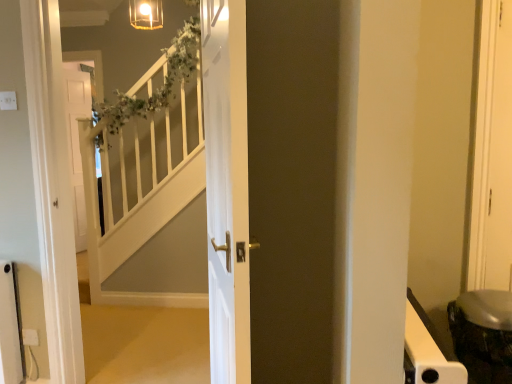
Question: Would you say white glossy door at center is part of white plastic electric outlet at lower left's contents?

Choices:
 (A) yes
 (B) no

Answer: (B)

Question: Is white plastic electric outlet at lower left completely or partially outside of white glossy door at center?

Choices:
 (A) no
 (B) yes

Answer: (B)

Question: From a real-world perspective, does white plastic electric outlet at lower left sit lower than white glossy door at center?

Choices:
 (A) yes
 (B) no

Answer: (A)

Question: Does white plastic electric outlet at lower left have a smaller size compared to white glossy door at center?

Choices:
 (A) yes
 (B) no

Answer: (A)

Question: Can you confirm if white plastic electric outlet at lower left is bigger than white glossy door at center?

Choices:
 (A) no
 (B) yes

Answer: (A)

Question: Is white plastic electric outlet at lower left behind white glossy door at center?

Choices:
 (A) no
 (B) yes

Answer: (B)

Question: From a real-world perspective, is white glossy door at center beneath white plastic electric outlet at lower left?

Choices:
 (A) no
 (B) yes

Answer: (A)

Question: Can you confirm if white glossy door at center is wider than white plastic electric outlet at lower left?

Choices:
 (A) yes
 (B) no

Answer: (A)

Question: Is white glossy door at center positioned in front of white plastic electric outlet at lower left?

Choices:
 (A) yes
 (B) no

Answer: (A)

Question: Is white glossy door at center oriented away from white plastic electric outlet at lower left?

Choices:
 (A) yes
 (B) no

Answer: (B)

Question: Is white glossy door at center smaller than white plastic electric outlet at lower left?

Choices:
 (A) yes
 (B) no

Answer: (B)

Question: Would you say white glossy door at center contains white plastic electric outlet at lower left?

Choices:
 (A) yes
 (B) no

Answer: (B)

Question: Is white glossy door at center spatially inside white plastic electric outlet at lower left, or outside of it?

Choices:
 (A) inside
 (B) outside

Answer: (B)